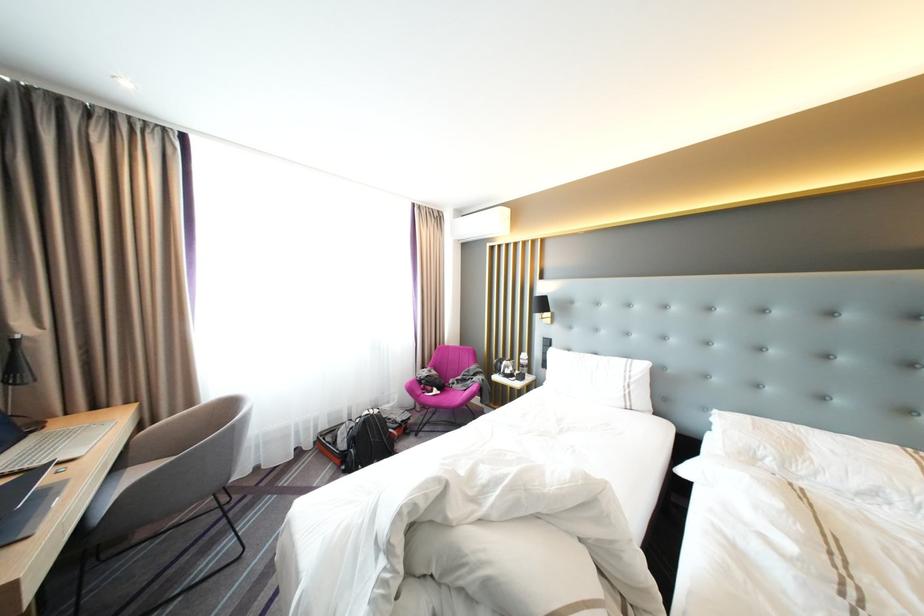
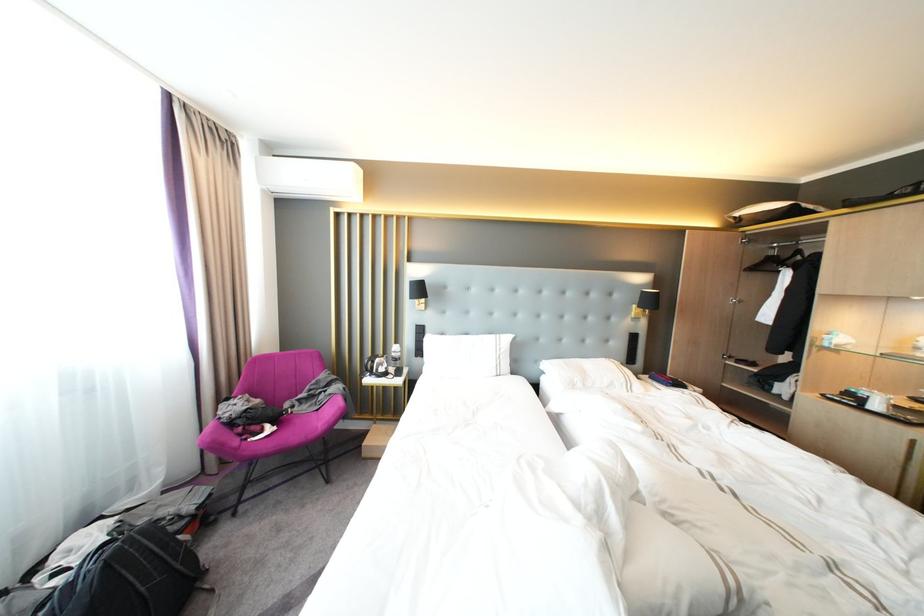
Question: The camera is either moving clockwise (left) or counter-clockwise (right) around the object. The first image is from the beginning of the video and the second image is from the end. Is the camera moving left or right when shooting the video?

Choices:
 (A) Left
 (B) Right

Answer: (A)